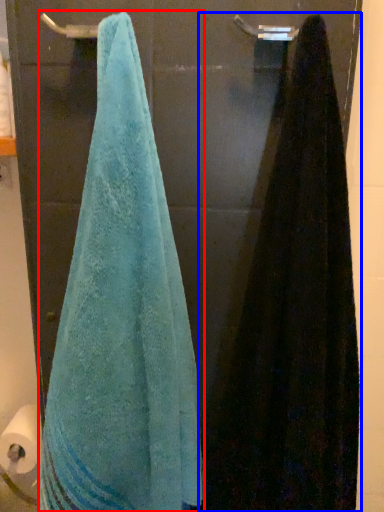
Question: Which point is further to the camera, towel (highlighted by a red box) or towel (highlighted by a blue box)?

Choices:
 (A) towel
 (B) towel

Answer: (A)